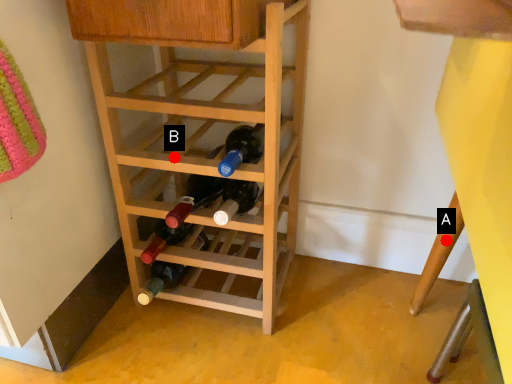
Question: Two points are circled on the image, labeled by A and B beside each circle. Which of the following is the closest to the observer?

Choices:
 (A) A is closer
 (B) B is closer

Answer: (A)